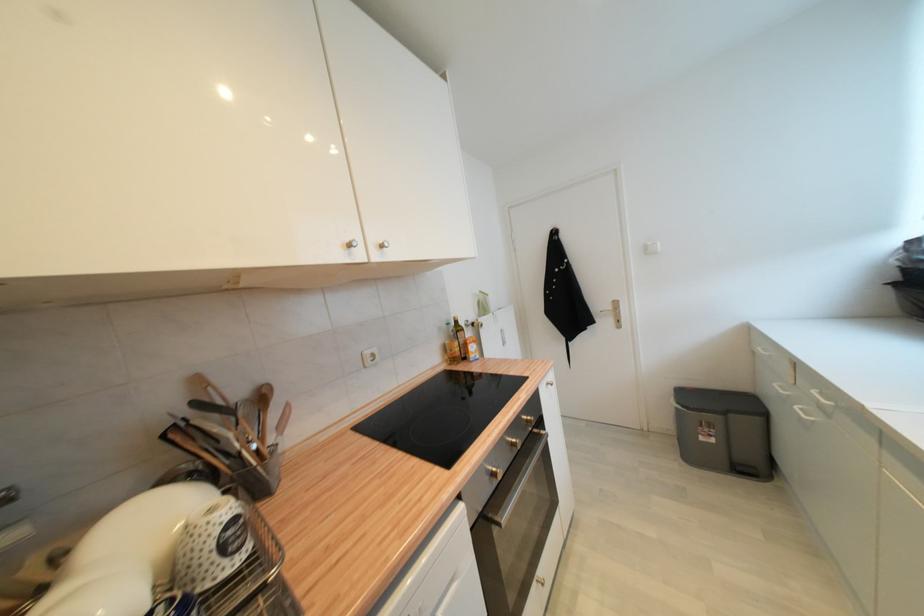
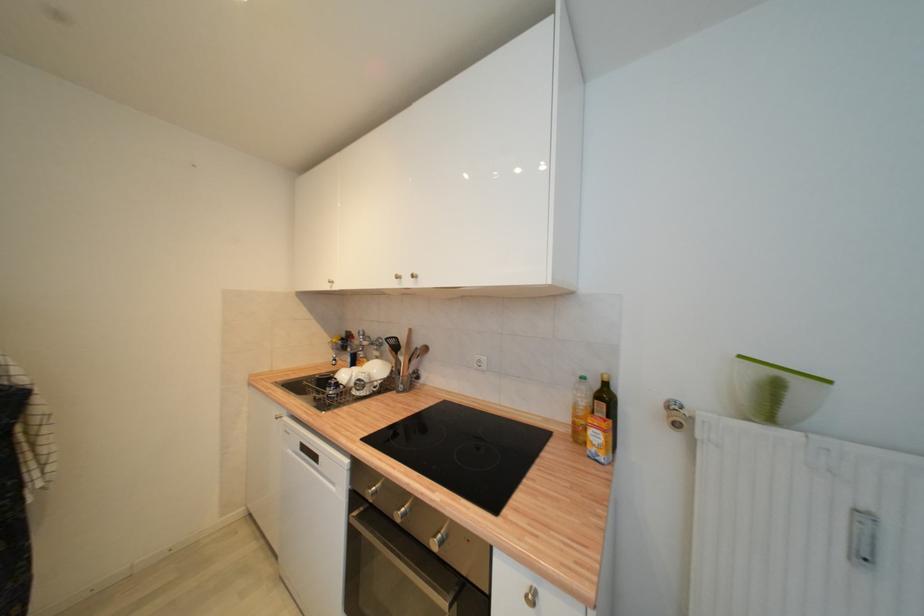
Where in the second image is the point corresponding to (x=453, y=326) from the first image?

(586, 379)